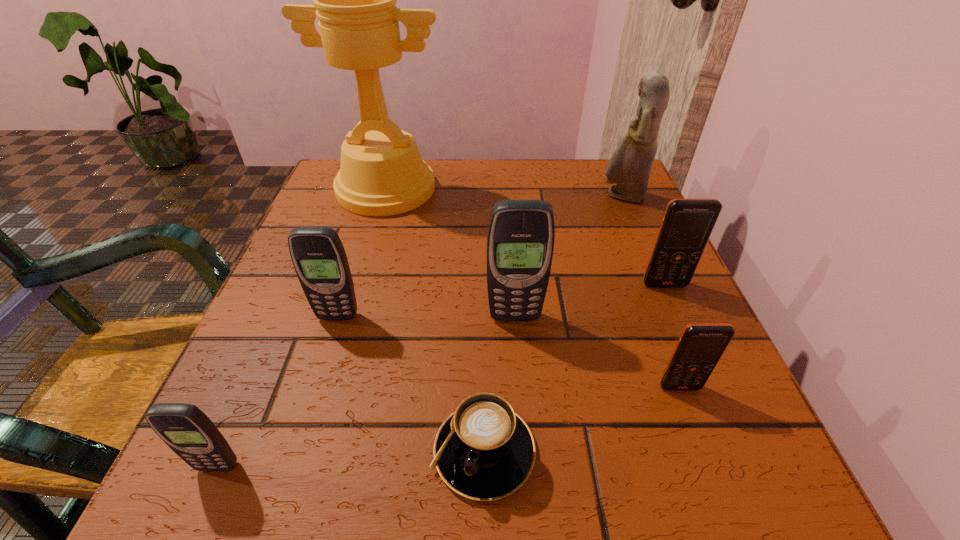
This screenshot has width=960, height=540. I want to click on free space between the seventh shortest object and the leftmost cellular telephone, so click(420, 331).

Where is `free spot between the seventh shortest object and the bigger orange cellular telephone`? The image size is (960, 540). free spot between the seventh shortest object and the bigger orange cellular telephone is located at coordinates (643, 240).

Locate an element on the screen. empty location between the third cellular telephone from left to right and the leftmost cellular telephone is located at coordinates (366, 392).

Identify the location of empty space that is in between the fourth cellular telephone from right to left and the award. (362, 253).

The width and height of the screenshot is (960, 540). In order to click on vacant space in between the tallest object and the fourth cellular telephone from right to left in this screenshot , I will do `click(362, 253)`.

Select which object is the third closest to the smallest gray cellular telephone. Please provide its 2D coordinates. Your answer should be formatted as a tuple, i.e. [(x, y)], where the tuple contains the x and y coordinates of a point satisfying the conditions above.

[(520, 240)]

The image size is (960, 540). I want to click on object that is the seventh nearest to the figurine, so click(x=189, y=432).

At what (x,y) coordinates should I click in order to perform the action: click on cellular telephone that can be found as the fifth closest to the second tallest object. Please return your answer as a coordinate pair (x, y). Looking at the image, I should click on (189, 432).

In order to click on the third closest cellular telephone to the rightmost gray cellular telephone in this screenshot , I will do `click(319, 258)`.

Identify which gray cellular telephone is the second closest to the smallest gray cellular telephone. Please provide its 2D coordinates. Your answer should be formatted as a tuple, i.e. [(x, y)], where the tuple contains the x and y coordinates of a point satisfying the conditions above.

[(520, 240)]